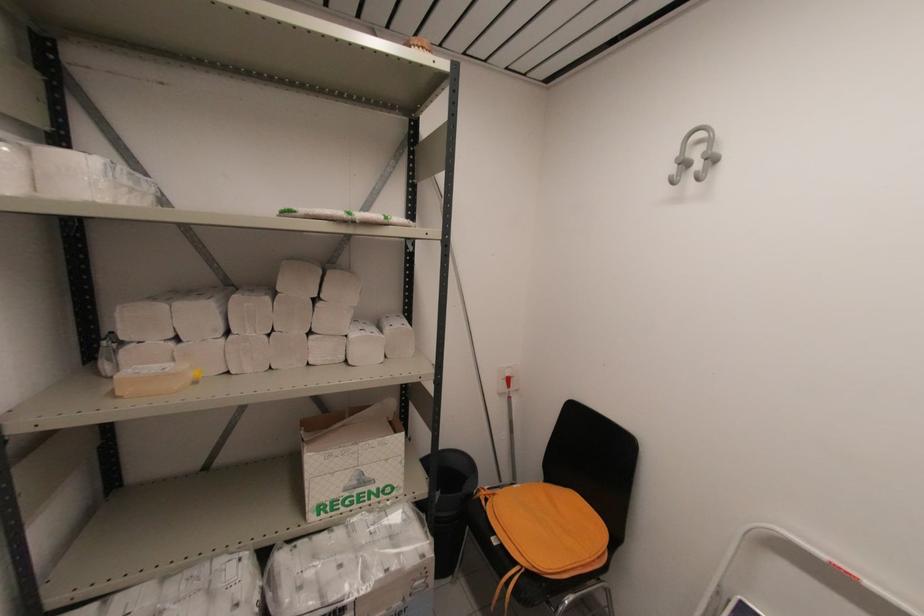
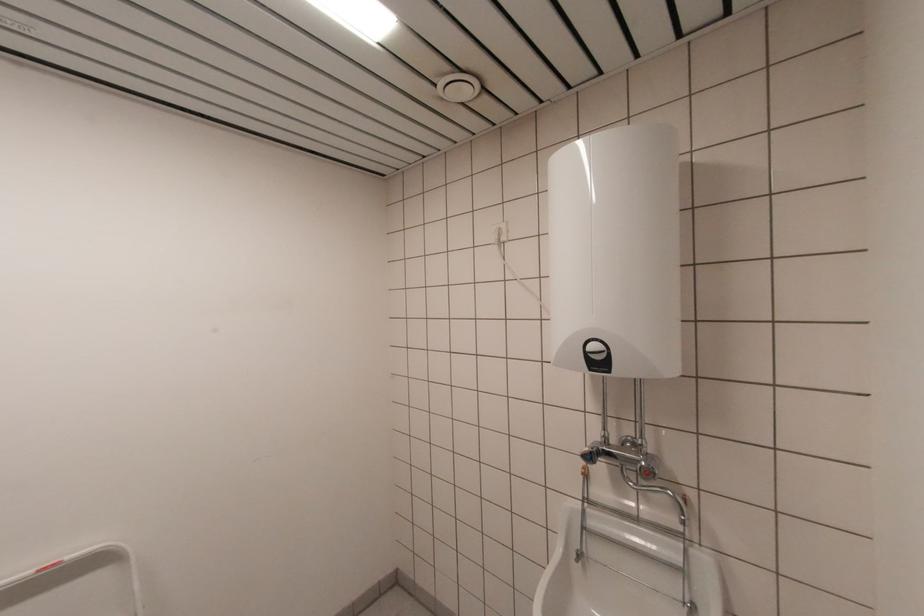
Question: The images are taken continuously from a first-person perspective. In which direction is your viewpoint rotating?

Choices:
 (A) Left
 (B) Right
 (C) Up
 (D) Down

Answer: (B)